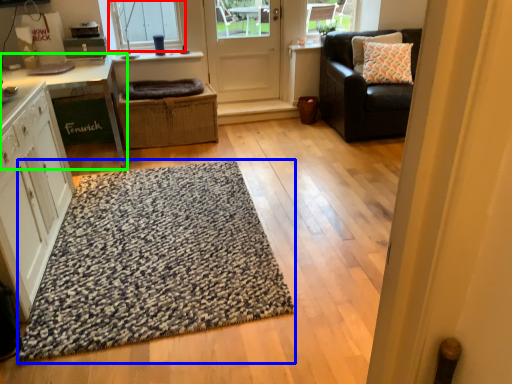
Question: Considering the real-world distances, which object is farthest from window (highlighted by a red box)? doormat (highlighted by a blue box) or table (highlighted by a green box)?

Choices:
 (A) doormat
 (B) table

Answer: (A)